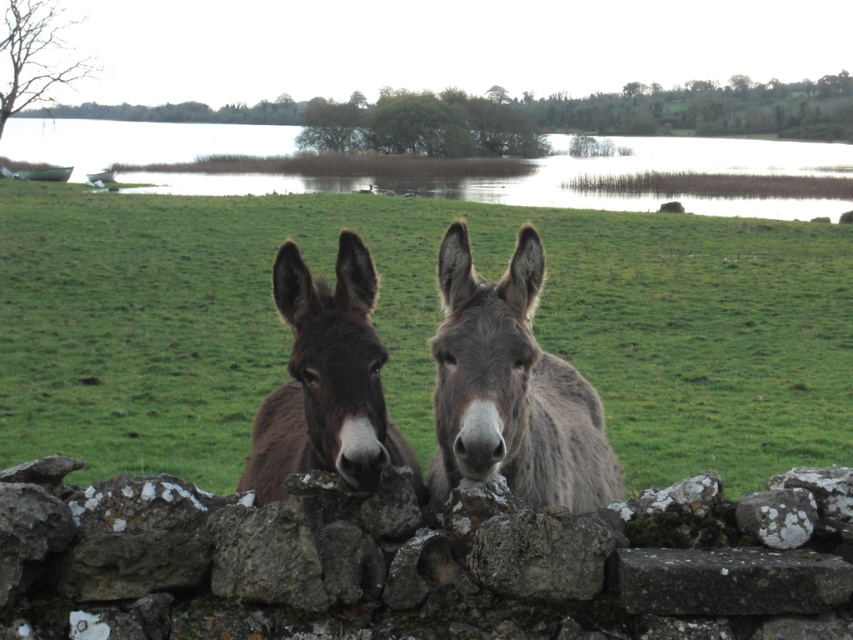
Is point (755, 392) positioned in front of point (802, 499)?

No, (755, 392) is behind (802, 499).

Is brown furry donkeys at center closer to the viewer compared to white lichen-covered rock at center?

No.

Who is more forward, (635, 488) or (799, 492)?

Point (799, 492)

Image resolution: width=853 pixels, height=640 pixels. Find the location of `brown furry donkeys at center`. brown furry donkeys at center is located at coordinates point(413,326).

Between gray fuzzy mule at center and white lichen-covered rock at center, which one has less height?

Standing shorter between the two is white lichen-covered rock at center.

Which is more to the right, gray fuzzy mule at center or white lichen-covered rock at center?

Positioned to the right is white lichen-covered rock at center.

The width and height of the screenshot is (853, 640). What do you see at coordinates (511, 388) in the screenshot?
I see `gray fuzzy mule at center` at bounding box center [511, 388].

Where is `gray fuzzy mule at center`? The image size is (853, 640). gray fuzzy mule at center is located at coordinates (511, 388).

Does brown furry donkeys at center have a lesser height compared to brown fuzzy mule at center?

Incorrect, brown furry donkeys at center's height does not fall short of brown fuzzy mule at center's.

Who is more distant from viewer, (102, 440) or (355, 403)?

The point (102, 440) is behind.

Which is in front, point (723, 250) or point (335, 458)?

Positioned in front is point (335, 458).

Identify the location of brown furry donkeys at center. This screenshot has width=853, height=640. (413, 326).